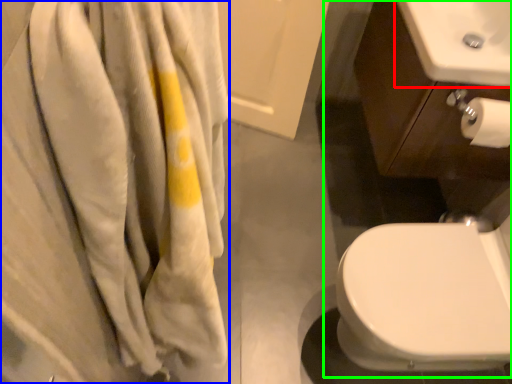
Question: Which object is positioned closest to sink (highlighted by a red box)? Select from bath towel (highlighted by a blue box) and sink (highlighted by a green box).

Choices:
 (A) bath towel
 (B) sink

Answer: (B)